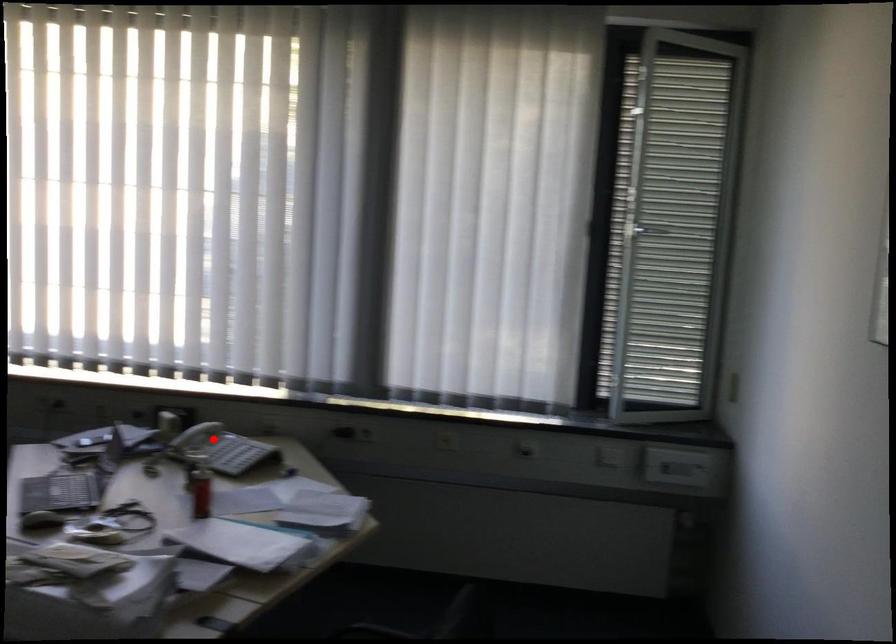
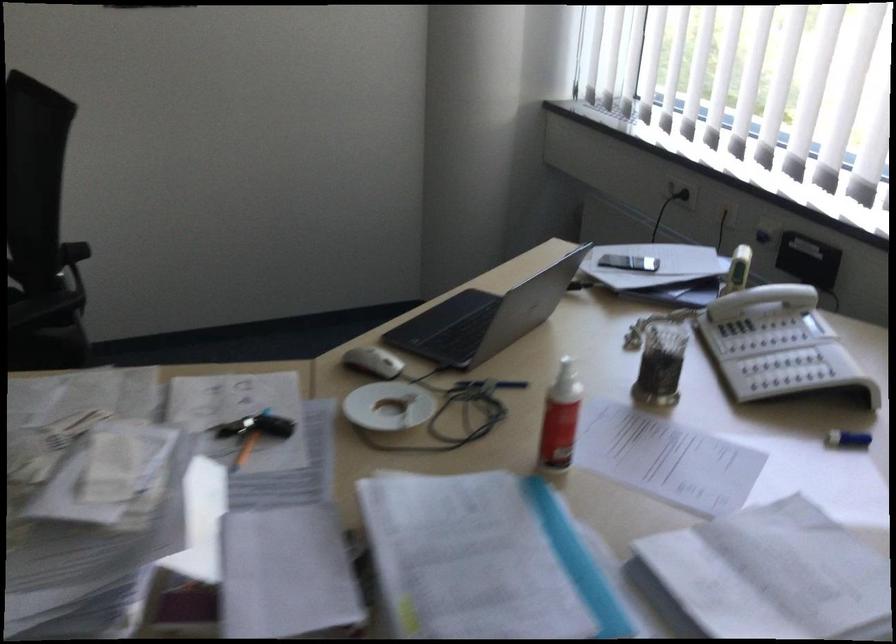
Question: I am providing you with two images of the same scene from different viewpoints. Image1 has a red point marked. In image2, the corresponding 3D location appears at what relative position? Reply with the corresponding letter.

Choices:
 (A) Closer
 (B) Farther

Answer: (A)